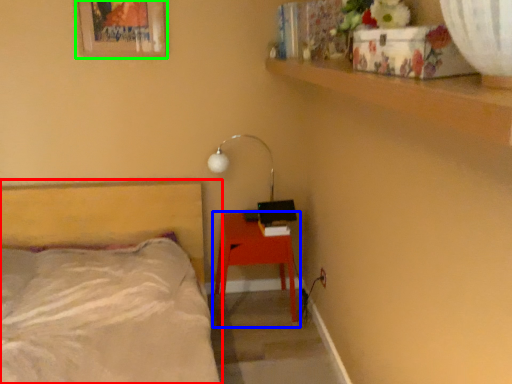
Question: Which object is positioned farthest from bed (highlighted by a red box)? Select from nightstand (highlighted by a blue box) and picture frame (highlighted by a green box).

Choices:
 (A) nightstand
 (B) picture frame

Answer: (B)